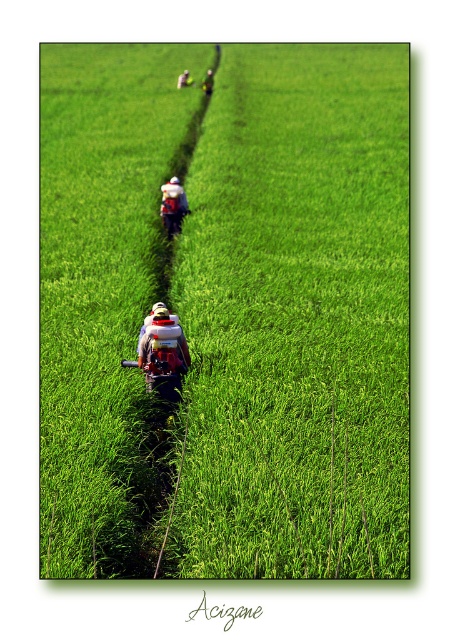
Question: In this image, where is metallic red sprayer at center located relative to camouflage fabric backpack at center?

Choices:
 (A) left
 (B) right

Answer: (B)

Question: Which point is closer to the camera?

Choices:
 (A) (143, 339)
 (B) (67, 442)
 (C) (189, 72)

Answer: (B)

Question: Based on their relative distances, which object is nearer to the camouflage fabric backpack at center?

Choices:
 (A) green grassy field at center
 (B) metallic red sprayer at center

Answer: (A)

Question: Does green grassy field at center appear on the right side of camouflage fabric backpack at center?

Choices:
 (A) no
 (B) yes

Answer: (B)

Question: Is light blue fabric backpack at center bigger than camouflage fabric backpack at center?

Choices:
 (A) no
 (B) yes

Answer: (A)

Question: Which is farther from the light blue fabric backpack at center?

Choices:
 (A) camouflage fabric backpack at center
 (B) green fabric backpack at center
 (C) metallic red sprayer at center
 (D) green grassy field at center

Answer: (A)